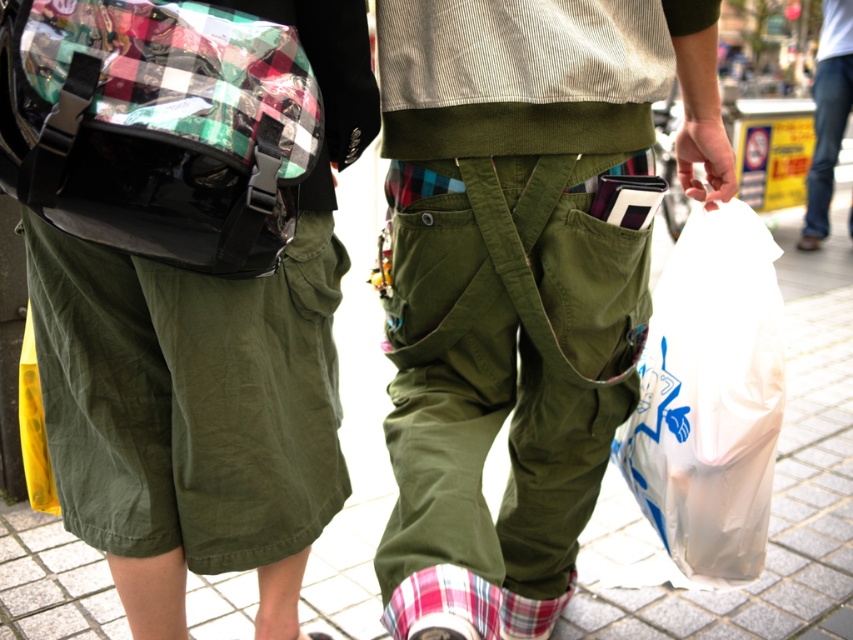
Question: Does olive green pants at center lie in front of transparent plastic bag at lower right?

Choices:
 (A) yes
 (B) no

Answer: (A)

Question: Which is farther from the olive green pants at center?

Choices:
 (A) plaid fabric bag at left
 (B) olive green canvas pocket at center
 (C) transparent plastic bag at lower right

Answer: (A)

Question: Which object is farther from the camera taking this photo?

Choices:
 (A) olive green pants at center
 (B) plaid fabric bag at left
 (C) olive green canvas pocket at center

Answer: (C)

Question: Which object appears farthest from the camera in this image?

Choices:
 (A) olive green canvas pocket at center
 (B) olive green pants at center

Answer: (A)

Question: Is plaid fabric bag at left positioned before olive green canvas pocket at center?

Choices:
 (A) no
 (B) yes

Answer: (B)

Question: Is transparent plastic bag at lower right bigger than olive green canvas pocket at center?

Choices:
 (A) yes
 (B) no

Answer: (A)